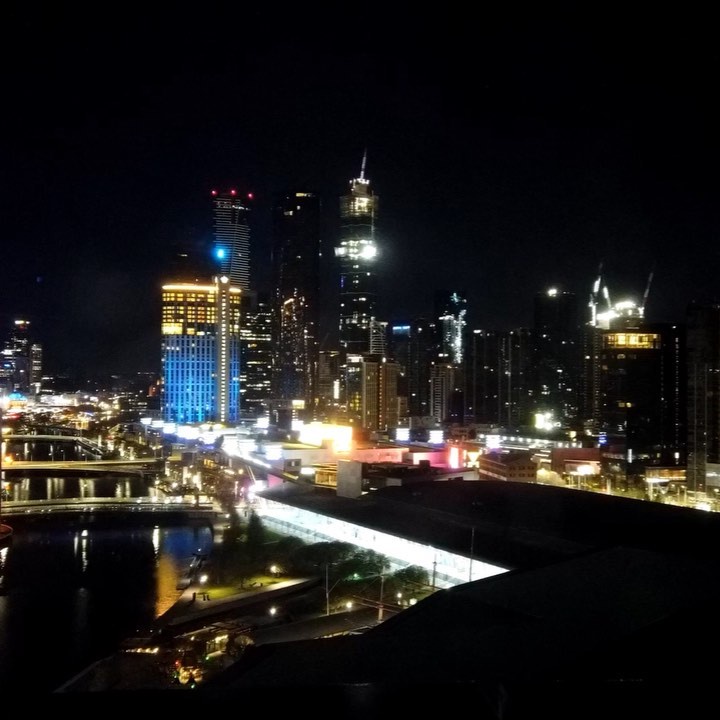
Identify the location of red lights. This screenshot has width=720, height=720. coord(216,192), coord(230,192), coord(251,196), coord(454,456).